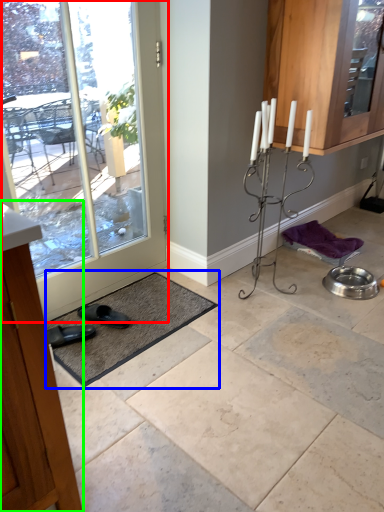
Question: Estimate the real-world distances between objects in this image. Which object is farther from door (highlighted by a red box), bath mat (highlighted by a blue box) or cabinetry (highlighted by a green box)?

Choices:
 (A) bath mat
 (B) cabinetry

Answer: (B)